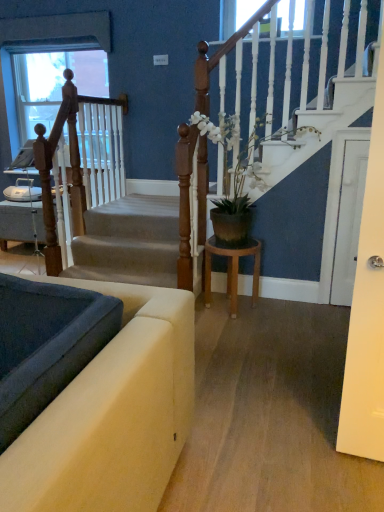
Question: From the image's perspective, is smooth gray carpet at lower left under wooden at left?

Choices:
 (A) no
 (B) yes

Answer: (B)

Question: Can you confirm if smooth gray carpet at lower left is shorter than wooden at left?

Choices:
 (A) yes
 (B) no

Answer: (A)

Question: Considering the relative positions of smooth gray carpet at lower left and wooden at left in the image provided, is smooth gray carpet at lower left to the left of wooden at left from the viewer's perspective?

Choices:
 (A) yes
 (B) no

Answer: (B)

Question: Is smooth gray carpet at lower left wider than wooden at left?

Choices:
 (A) yes
 (B) no

Answer: (A)

Question: Can you confirm if smooth gray carpet at lower left is smaller than wooden at left?

Choices:
 (A) no
 (B) yes

Answer: (B)

Question: Considering the relative positions of smooth gray carpet at lower left and wooden at left in the image provided, is smooth gray carpet at lower left in front of wooden at left?

Choices:
 (A) no
 (B) yes

Answer: (B)

Question: From the image's perspective, would you say wooden stool at center is shown under white glossy door at right?

Choices:
 (A) no
 (B) yes

Answer: (B)

Question: Is wooden stool at center to the right of white glossy door at right from the viewer's perspective?

Choices:
 (A) yes
 (B) no

Answer: (B)

Question: Can you confirm if wooden stool at center is smaller than white glossy door at right?

Choices:
 (A) yes
 (B) no

Answer: (B)

Question: Can white glossy door at right be found inside wooden stool at center?

Choices:
 (A) yes
 (B) no

Answer: (B)

Question: Is wooden stool at center closer to the viewer compared to white glossy door at right?

Choices:
 (A) no
 (B) yes

Answer: (B)

Question: Does wooden stool at center turn towards white glossy door at right?

Choices:
 (A) yes
 (B) no

Answer: (B)

Question: Does velvet beige sofa at lower left lie behind white glossy door at right?

Choices:
 (A) no
 (B) yes

Answer: (A)